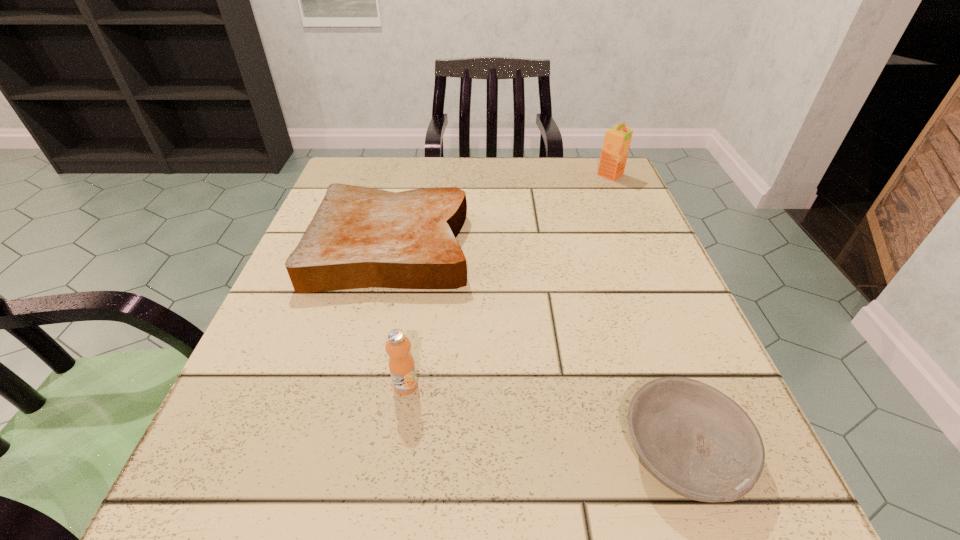
Locate an element on the screen. The height and width of the screenshot is (540, 960). the right orange juice is located at coordinates (617, 139).

This screenshot has height=540, width=960. I want to click on the tallest object, so click(x=617, y=139).

Where is `the second nearest object`? the second nearest object is located at coordinates (401, 363).

The image size is (960, 540). In order to click on the left orange juice in this screenshot , I will do `click(401, 363)`.

Identify the location of the second farthest object. Image resolution: width=960 pixels, height=540 pixels. (360, 237).

Find the location of a particular element. The height and width of the screenshot is (540, 960). bread is located at coordinates (360, 237).

Locate an element on the screen. Image resolution: width=960 pixels, height=540 pixels. the shortest object is located at coordinates pyautogui.click(x=698, y=442).

The width and height of the screenshot is (960, 540). Identify the location of bowl. (698, 442).

Identify the location of vacant region located 0.240m on the front of the tallest object. (640, 242).

Find the location of a particular element. blank space located 0.100m on the front label of the left orange juice is located at coordinates (394, 467).